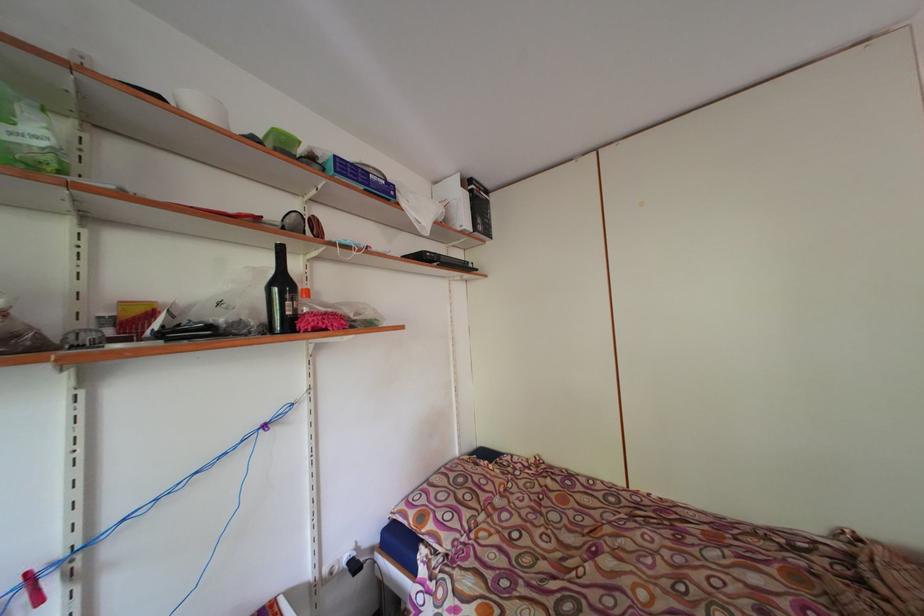
This screenshot has width=924, height=616. Find the location of `red clothespin`. red clothespin is located at coordinates (32, 589).